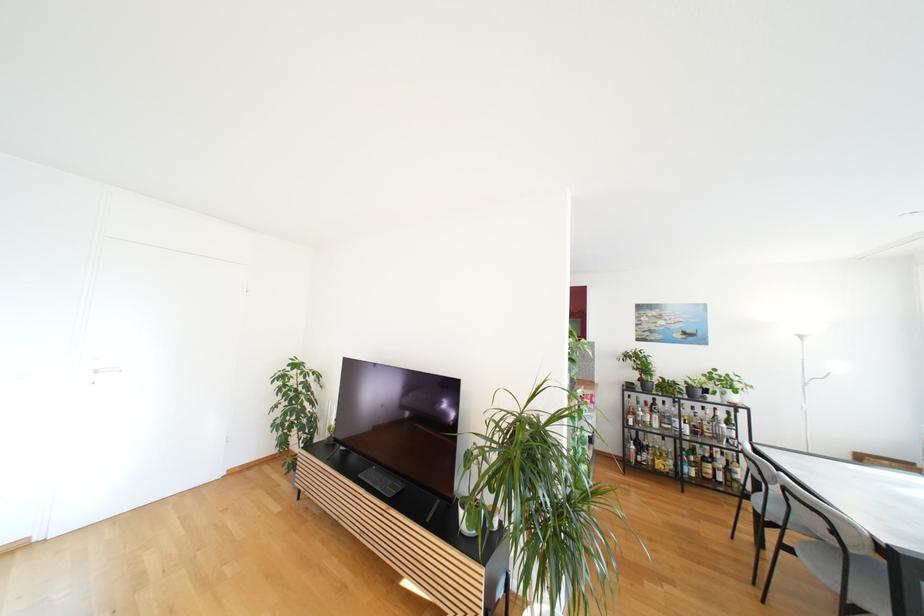
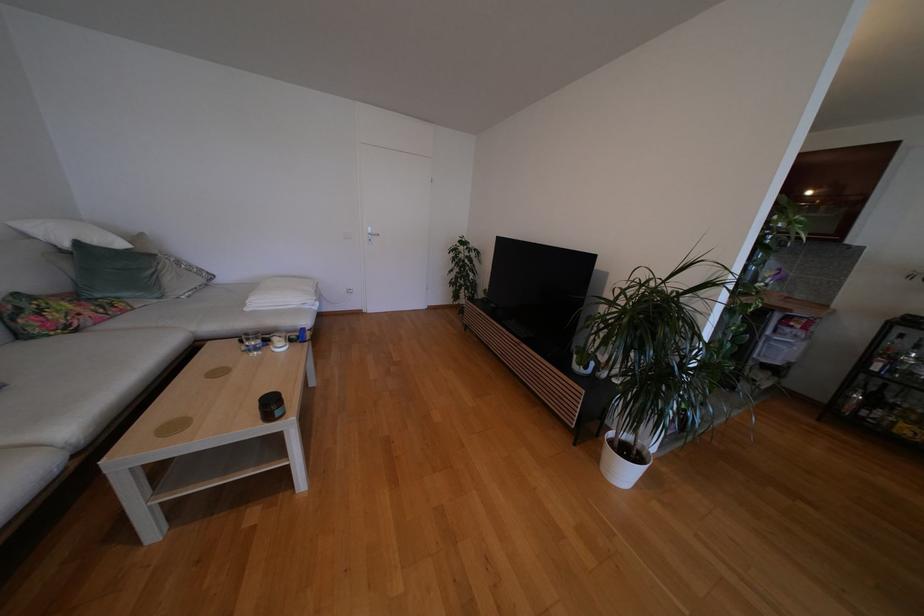
The first image is from the beginning of the video and the second image is from the end. How did the camera likely rotate when shooting the video?

The camera's rotation is toward left-down.